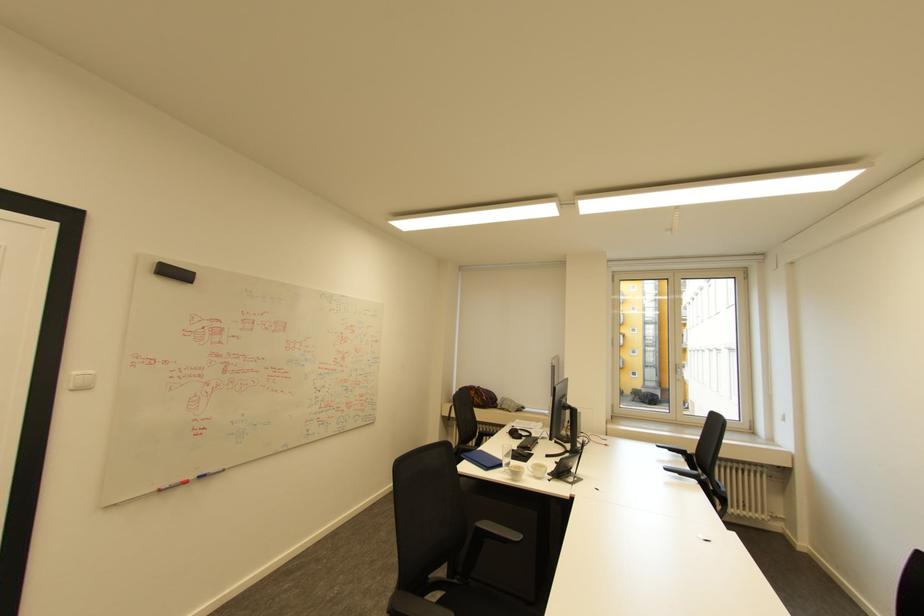
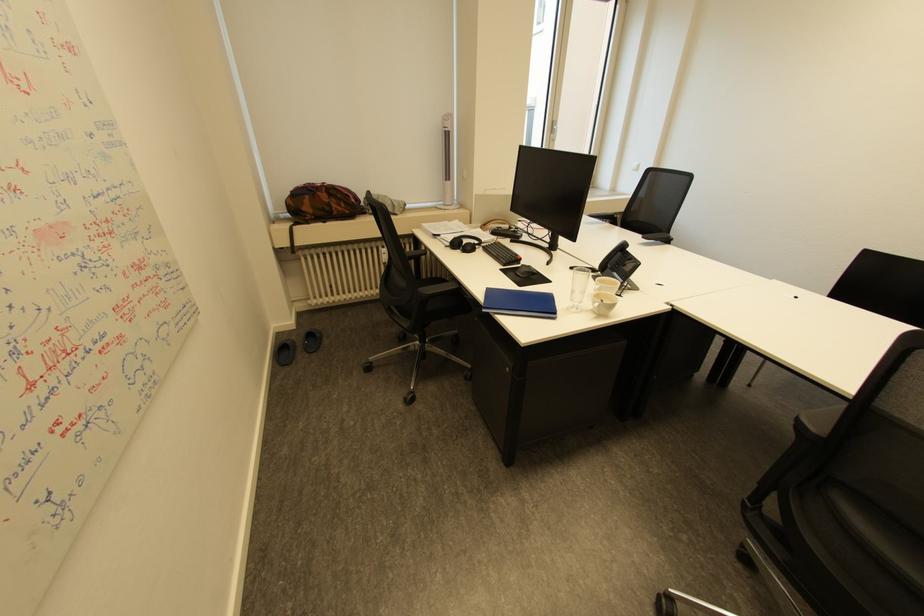
Question: I am providing you with two images of the same scene from different viewpoints. Please identify which objects are invisible in image2.

Choices:
 (A) blue folder
 (B) chair sitting surface
 (C) black computer mouse
 (D) none of these

Answer: (D)